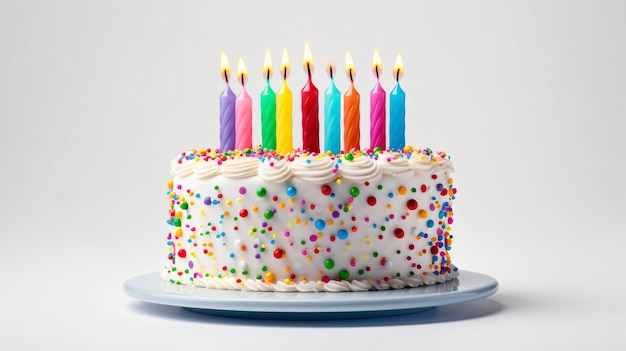
Locate an element on the screen. The width and height of the screenshot is (626, 351). flames on candles is located at coordinates (222, 68), (243, 68), (269, 63), (287, 60), (308, 55), (327, 68), (352, 67), (375, 65), (397, 70).